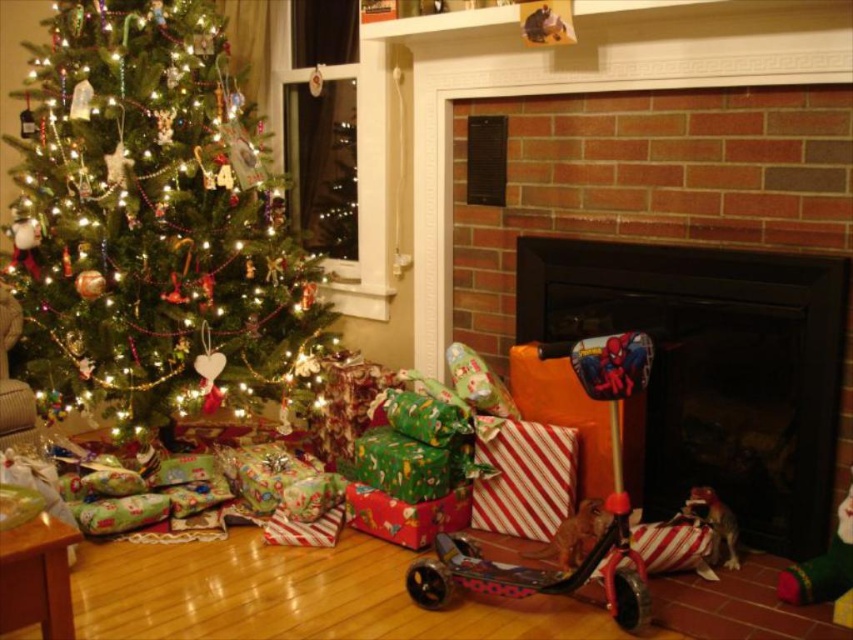
Can you confirm if black matte fireplace at center is smaller than metallic pink scooter at lower center?

No.

Which is in front, point (698, 282) or point (635, 376)?

Positioned in front is point (635, 376).

Locate an element on the screen. This screenshot has width=853, height=640. black matte fireplace at center is located at coordinates (712, 368).

Is shiny green tree at left further to camera compared to metallic pink scooter at lower center?

Yes.

How much distance is there between shiny green tree at left and metallic pink scooter at lower center?

The distance of shiny green tree at left from metallic pink scooter at lower center is 5.15 feet.

The width and height of the screenshot is (853, 640). In order to click on shiny green tree at left in this screenshot , I will do tap(149, 218).

Identify the location of shiny green tree at left. (149, 218).

Is shiny green tree at left positioned behind black matte fireplace at center?

Yes.

Which of these two, shiny green tree at left or black matte fireplace at center, stands taller?

shiny green tree at left

Between point (126, 300) and point (704, 380), which one is positioned behind?

Point (126, 300)

This screenshot has height=640, width=853. What are the coordinates of `shiny green tree at left` in the screenshot? It's located at (149, 218).